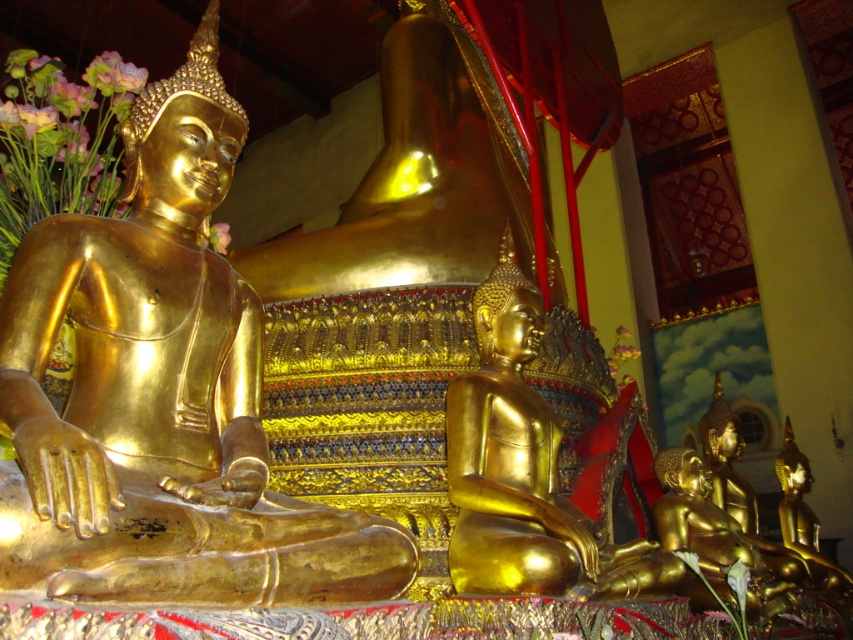
Question: Does gold shiny statue at left have a smaller size compared to gold polished statue at center?

Choices:
 (A) no
 (B) yes

Answer: (B)

Question: Is gold polished statue at center above pink silk flowers at left?

Choices:
 (A) no
 (B) yes

Answer: (B)

Question: Based on their relative distances, which object is nearer to the gold shiny statue at left?

Choices:
 (A) gold polished statue at center
 (B) pink silk flowers at left

Answer: (B)

Question: Among these points, which one is nearest to the camera?

Choices:
 (A) (572, 564)
 (B) (109, 196)
 (C) (410, 161)

Answer: (A)

Question: Which of the following is the closest to the observer?

Choices:
 (A) pink silk flowers at left
 (B) gold shiny statue at left
 (C) gold polished statue at center

Answer: (B)

Question: From the image, what is the correct spatial relationship of gold polished statue at center in relation to pink silk flowers at left?

Choices:
 (A) below
 (B) above

Answer: (B)